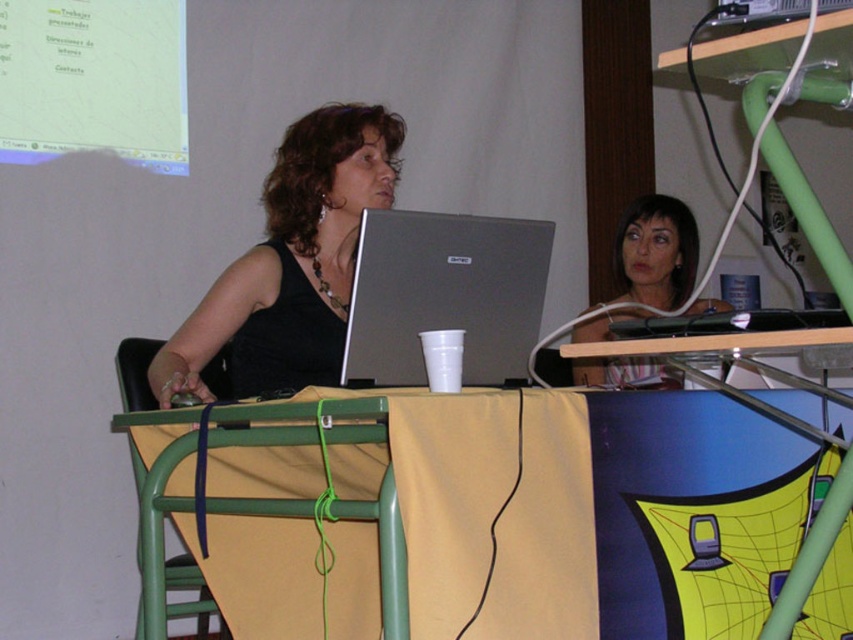
You are a GUI agent. You are given a task and a screenshot of the screen. Output one action in this format:
    pyautogui.click(x=<x>, y=<y>)
    Task: Click on the silver metallic laptop at center
    Image resolution: width=853 pixels, height=640 pixels.
    Given the screenshot: What is the action you would take?
    pyautogui.click(x=445, y=296)

Who is lower down, silver metallic laptop at center or green plastic chair at lower left?

green plastic chair at lower left is below.

What do you see at coordinates (445, 296) in the screenshot? I see `silver metallic laptop at center` at bounding box center [445, 296].

Where is `silver metallic laptop at center`? silver metallic laptop at center is located at coordinates (445, 296).

Between point (328, 291) and point (619, 282), which one is positioned behind?

The point (619, 282) is behind.

At what (x,y) coordinates should I click in order to perform the action: click on black matte tank top at center. Please return your answer as a coordinate pair (x, y). This screenshot has width=853, height=640. Looking at the image, I should click on (291, 262).

Is point (329, 250) closer to camera compared to point (666, 291)?

Yes, it is in front of point (666, 291).

This screenshot has width=853, height=640. I want to click on black matte tank top at center, so click(x=291, y=262).

Who is shorter, yellow fabric-covered table at center or black matte tank top at center?

Result: yellow fabric-covered table at center is shorter.

What do you see at coordinates (550, 500) in the screenshot? The image size is (853, 640). I see `yellow fabric-covered table at center` at bounding box center [550, 500].

This screenshot has width=853, height=640. What do you see at coordinates (550, 500) in the screenshot?
I see `yellow fabric-covered table at center` at bounding box center [550, 500].

Where is `yellow fabric-covered table at center`? yellow fabric-covered table at center is located at coordinates (550, 500).